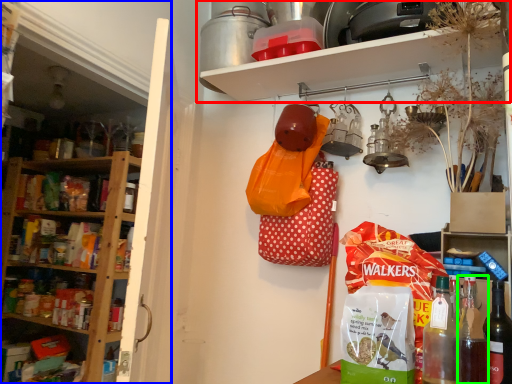
Question: Based on their relative distances, which object is nearer to shelf (highlighted by a red box)? Choose from shelf (highlighted by a blue box) and bottle (highlighted by a green box).

Choices:
 (A) shelf
 (B) bottle

Answer: (B)